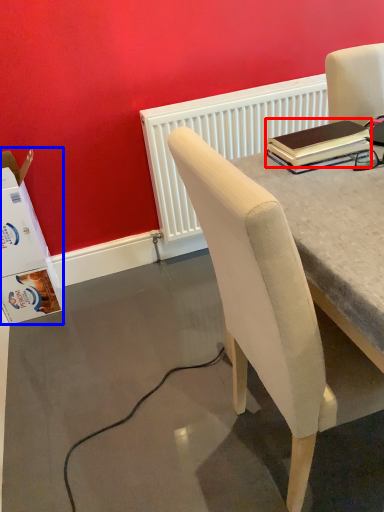
Question: Among these objects, which one is nearest to the camera, notebook (highlighted by a red box) or box (highlighted by a blue box)?

Choices:
 (A) notebook
 (B) box

Answer: (A)